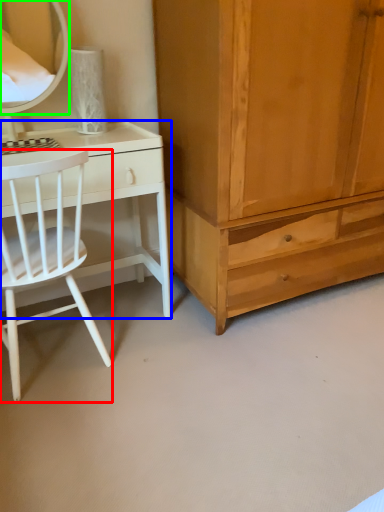
Question: Estimate the real-world distances between objects in this image. Which object is farther from chair (highlighted by a red box), desk (highlighted by a blue box) or mirror (highlighted by a green box)?

Choices:
 (A) desk
 (B) mirror

Answer: (B)